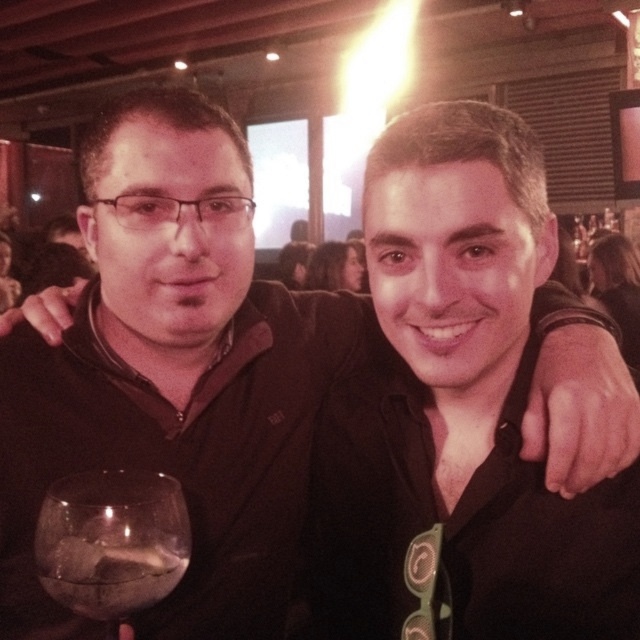
Is transparent glass at lower left below translucent glass wine at lower left?

No, transparent glass at lower left is not below translucent glass wine at lower left.

Is point (42, 520) behind point (35, 545)?

That is False.

At what (x,y) coordinates should I click in order to perform the action: click on transparent glass at lower left. Please return your answer as a coordinate pair (x, y). Looking at the image, I should click on (112, 541).